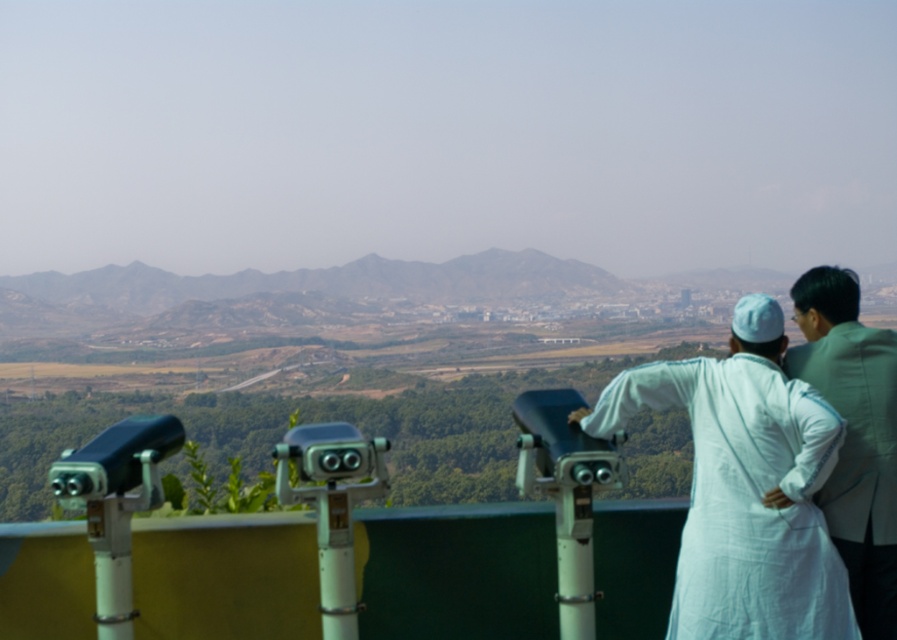
Question: Can you confirm if white cotton robe at center is positioned above white cotton robe at upper right?

Choices:
 (A) yes
 (B) no

Answer: (B)

Question: Can you confirm if white cotton robe at center is positioned above white cotton robe at upper right?

Choices:
 (A) no
 (B) yes

Answer: (A)

Question: Is white cotton robe at center wider than white cotton robe at upper right?

Choices:
 (A) yes
 (B) no

Answer: (A)

Question: Which of the following is the farthest from the observer?

Choices:
 (A) (835, 449)
 (B) (884, 378)

Answer: (B)